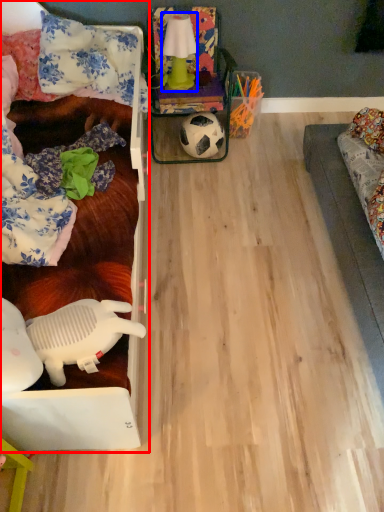
Question: Which object is closer to the camera taking this photo, furniture (highlighted by a red box) or lamp (highlighted by a blue box)?

Choices:
 (A) furniture
 (B) lamp

Answer: (A)